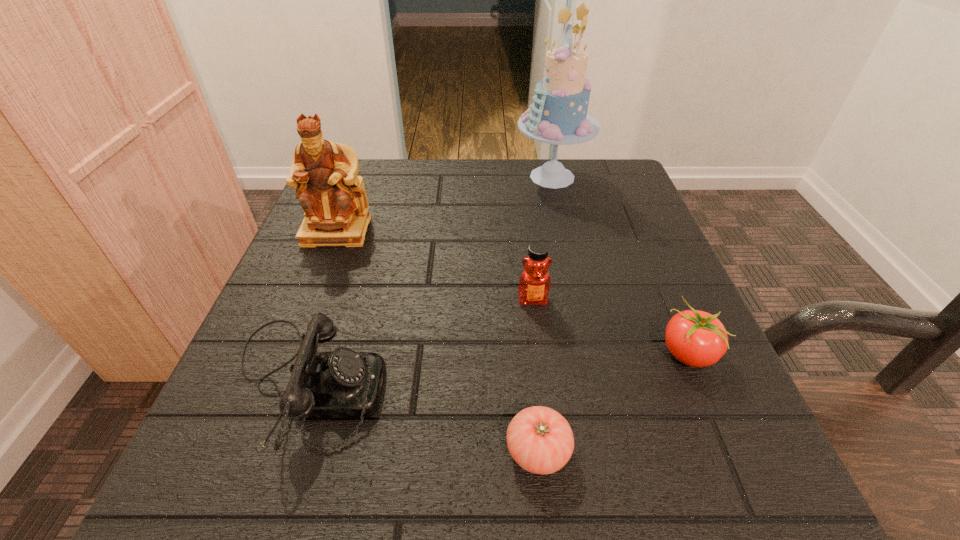
Where is `the left tomato`? This screenshot has height=540, width=960. the left tomato is located at coordinates (540, 440).

Where is `free spot located 0.380m with a ladder on the side of the farthest object`? This screenshot has height=540, width=960. free spot located 0.380m with a ladder on the side of the farthest object is located at coordinates (355, 177).

Identify the location of free space located 0.120m with a ladder on the side of the farthest object. (465, 177).

Find the location of a particular element. Image resolution: width=960 pixels, height=540 pixels. free space located 0.140m with a ladder on the side of the farthest object is located at coordinates (456, 177).

The height and width of the screenshot is (540, 960). I want to click on blank space located 0.340m on the front-facing side of the second tallest object, so click(269, 404).

Find the location of a particular element. The image size is (960, 540). vacant space located 0.230m on the front label of the fourth shortest object is located at coordinates (550, 443).

Image resolution: width=960 pixels, height=540 pixels. What are the coordinates of `vacant region located on the front-facing side of the telephone` in the screenshot? It's located at (426, 384).

The height and width of the screenshot is (540, 960). I want to click on free location located on the front of the taller tomato, so click(x=732, y=458).

Find the location of a particular element. The image size is (960, 540). free space located 0.060m on the back of the nearer tomato is located at coordinates (531, 382).

This screenshot has width=960, height=540. What are the coordinates of `object present at the far edge` in the screenshot? It's located at (558, 115).